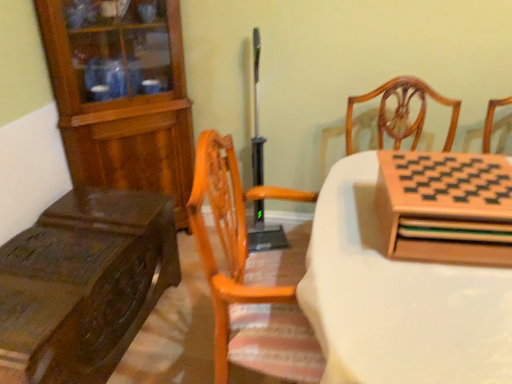
Describe the element at coordinates (397, 298) in the screenshot. I see `wooden chessboard at upper right, which appears as the 1th table when viewed from the right` at that location.

Where is `dark brown wood table at left, the first table positioned from the left`? dark brown wood table at left, the first table positioned from the left is located at coordinates (83, 284).

Locate an element on the screen. This screenshot has width=512, height=384. wooden cabinet at left, which ranks as the 2th cabinetry in front-to-back order is located at coordinates (123, 104).

The image size is (512, 384). Describe the element at coordinates (445, 207) in the screenshot. I see `wooden chessboard at right, the first cabinetry from the right` at that location.

What is the approximate height of wooden chessboard at right, the 1th cabinetry in the front-to-back sequence?

8.71 inches.

This screenshot has width=512, height=384. In order to click on wooden chessboard at upper right, which appears as the second table when viewed from the left in this screenshot , I will do `click(397, 298)`.

Considering the positions of objects wooden chessboard at right, the second cabinetry in the back-to-front sequence, and wooden chessboard at upper right, which appears as the 1th table when viewed from the right, in the image provided, who is more to the right, wooden chessboard at right, the second cabinetry in the back-to-front sequence, or wooden chessboard at upper right, which appears as the 1th table when viewed from the right,?

wooden chessboard at upper right, which appears as the 1th table when viewed from the right.

Does wooden chessboard at right, the 1th cabinetry in the front-to-back sequence, have a lesser height compared to wooden chessboard at upper right, which appears as the 1th table when viewed from the right?

Yes, wooden chessboard at right, the 1th cabinetry in the front-to-back sequence, is shorter than wooden chessboard at upper right, which appears as the 1th table when viewed from the right.

Considering the sizes of objects wooden chessboard at right, the first cabinetry from the right, and wooden chessboard at upper right, which appears as the second table when viewed from the left, in the image provided, who is wider, wooden chessboard at right, the first cabinetry from the right, or wooden chessboard at upper right, which appears as the second table when viewed from the left,?

With larger width is wooden chessboard at upper right, which appears as the second table when viewed from the left.

How different are the orientations of wooden chessboard at right, the second cabinetry when ordered from left to right, and wooden chessboard at upper right, which appears as the 1th table when viewed from the right, in degrees?

wooden chessboard at right, the second cabinetry when ordered from left to right, and wooden chessboard at upper right, which appears as the 1th table when viewed from the right, are facing 87.7 degrees away from each other.

From a real-world perspective, who is located lower, wooden cabinet at left, which ranks as the 2th cabinetry in front-to-back order, or wooden chessboard at upper right, which appears as the 1th table when viewed from the right?

In real-world perspective, wooden chessboard at upper right, which appears as the 1th table when viewed from the right, is lower.

From the image's perspective, is wooden cabinet at left, marked as the second cabinetry in a right-to-left arrangement, beneath wooden chessboard at upper right, which appears as the second table when viewed from the left?

Actually, wooden cabinet at left, marked as the second cabinetry in a right-to-left arrangement, appears above wooden chessboard at upper right, which appears as the second table when viewed from the left, in the image.

Which object is wider, wooden cabinet at left, marked as the second cabinetry in a right-to-left arrangement, or wooden chessboard at upper right, which appears as the second table when viewed from the left?

wooden chessboard at upper right, which appears as the second table when viewed from the left, is wider.

Which object is wider, wooden cabinet at left, which appears as the first cabinetry when viewed from the back, or dark brown wood table at left, the first table positioned from the left?

With larger width is dark brown wood table at left, the first table positioned from the left.

Considering the positions of point (175, 104) and point (38, 362), is point (175, 104) closer or farther from the camera than point (38, 362)?

Clearly, point (175, 104) is more distant from the camera than point (38, 362).

From a real-world perspective, is wooden cabinet at left, which appears as the first cabinetry when viewed from the back, above or below dark brown wood table at left, the second table when ordered from right to left?

In terms of real-world spatial position, wooden cabinet at left, which appears as the first cabinetry when viewed from the back, is above dark brown wood table at left, the second table when ordered from right to left.

From the image's perspective, which one is positioned lower, wooden cabinet at left, placed as the 1th cabinetry when sorted from left to right, or dark brown wood table at left, the first table positioned from the left?

From the image's view, dark brown wood table at left, the first table positioned from the left, is below.

Does wooden cabinet at left, which appears as the first cabinetry when viewed from the back, turn towards wooden chessboard at right, the second cabinetry when ordered from left to right?

Yes, wooden cabinet at left, which appears as the first cabinetry when viewed from the back, is aimed at wooden chessboard at right, the second cabinetry when ordered from left to right.

Between point (168, 113) and point (422, 174), which one is positioned behind?

Positioned behind is point (168, 113).

Who is more distant, wooden cabinet at left, which ranks as the 2th cabinetry in front-to-back order, or wooden chessboard at right, the 1th cabinetry in the front-to-back sequence?

wooden cabinet at left, which ranks as the 2th cabinetry in front-to-back order, is further away from the camera.

The height and width of the screenshot is (384, 512). In the image, there is a wooden chessboard at upper right, which appears as the 1th table when viewed from the right. Identify the location of table above it (from the image's perspective). (83, 284).

Measure the distance from dark brown wood table at left, the second table when ordered from right to left, to wooden chessboard at upper right, which appears as the second table when viewed from the left.

They are 34.56 inches apart.

From a real-world perspective, is dark brown wood table at left, the first table positioned from the left, positioned over wooden chessboard at upper right, which appears as the second table when viewed from the left, based on gravity?

No, from a real-world perspective, dark brown wood table at left, the first table positioned from the left, is not above wooden chessboard at upper right, which appears as the second table when viewed from the left.

Looking at this image, would you consider dark brown wood table at left, the second table when ordered from right to left, to be distant from wooden chessboard at upper right, which appears as the 1th table when viewed from the right?

Actually, dark brown wood table at left, the second table when ordered from right to left, and wooden chessboard at upper right, which appears as the 1th table when viewed from the right, are a little close together.

From the image's perspective, is wooden chessboard at upper right, which appears as the second table when viewed from the left, located above or below wooden chessboard at right, the second cabinetry in the back-to-front sequence?

Clearly, from the image's perspective, wooden chessboard at upper right, which appears as the second table when viewed from the left, is below wooden chessboard at right, the second cabinetry in the back-to-front sequence.

From a real-world perspective, starting from the wooden chessboard at upper right, which appears as the 1th table when viewed from the right, which cabinetry is the 2nd one vertically above it? Please provide its 2D coordinates.

[(445, 207)]

Is the depth of wooden chessboard at upper right, which appears as the 1th table when viewed from the right, greater than that of wooden chessboard at right, the first cabinetry from the right?

No, it is not.

Does dark brown wood table at left, the first table positioned from the left, lie behind wooden chessboard at right, the 1th cabinetry in the front-to-back sequence?

Yes, it is behind wooden chessboard at right, the 1th cabinetry in the front-to-back sequence.

Considering the points (12, 265) and (413, 198), which point is in front, point (12, 265) or point (413, 198)?

The point (413, 198) is closer.

From the image's perspective, relative to wooden chessboard at right, the second cabinetry when ordered from left to right, is dark brown wood table at left, the second table when ordered from right to left, above or below?

dark brown wood table at left, the second table when ordered from right to left, is situated lower than wooden chessboard at right, the second cabinetry when ordered from left to right, in the image.

From a real-world perspective, which is physically above, dark brown wood table at left, the first table positioned from the left, or wooden chessboard at right, the 1th cabinetry in the front-to-back sequence?

In real-world perspective, wooden chessboard at right, the 1th cabinetry in the front-to-back sequence, is above.

Locate an element on the screen. Image resolution: width=512 pixels, height=384 pixels. the 1st table directly beneath the wooden chessboard at right, the 1th cabinetry in the front-to-back sequence (from a real-world perspective) is located at coordinates [x=397, y=298].

From the image's perspective, count 2nd cabinetrys upward from the wooden chessboard at upper right, which appears as the 1th table when viewed from the right, and point to it. Please provide its 2D coordinates.

[(123, 104)]

Estimate the real-world distances between objects in this image. Which object is closer to wooden cabinet at left, which appears as the first cabinetry when viewed from the back, dark brown wood table at left, the first table positioned from the left, or wooden chessboard at upper right, which appears as the second table when viewed from the left?

dark brown wood table at left, the first table positioned from the left, is positioned closer to the anchor wooden cabinet at left, which appears as the first cabinetry when viewed from the back.

Looking at the image, which one is located closer to dark brown wood table at left, the first table positioned from the left, wooden chessboard at upper right, which appears as the second table when viewed from the left, or wooden cabinet at left, placed as the 1th cabinetry when sorted from left to right?

wooden cabinet at left, placed as the 1th cabinetry when sorted from left to right, is positioned closer to the anchor dark brown wood table at left, the first table positioned from the left.

Based on their spatial positions, is wooden chessboard at upper right, which appears as the second table when viewed from the left, or wooden chessboard at right, the second cabinetry in the back-to-front sequence, further from wooden cabinet at left, placed as the 1th cabinetry when sorted from left to right?

The object further to wooden cabinet at left, placed as the 1th cabinetry when sorted from left to right, is wooden chessboard at right, the second cabinetry in the back-to-front sequence.

Estimate the real-world distances between objects in this image. Which object is further from wooden chessboard at upper right, which appears as the 1th table when viewed from the right, wooden chessboard at right, the first cabinetry from the right, or dark brown wood table at left, the first table positioned from the left?

The object further to wooden chessboard at upper right, which appears as the 1th table when viewed from the right, is dark brown wood table at left, the first table positioned from the left.

When comparing their distances from wooden chessboard at right, the second cabinetry when ordered from left to right, does wooden chessboard at upper right, which appears as the 1th table when viewed from the right, or dark brown wood table at left, the first table positioned from the left, seem further?

dark brown wood table at left, the first table positioned from the left, is further to wooden chessboard at right, the second cabinetry when ordered from left to right.

Considering their positions, is wooden chessboard at right, the 1th cabinetry in the front-to-back sequence, positioned further to wooden cabinet at left, which appears as the first cabinetry when viewed from the back, than wooden chessboard at upper right, which appears as the 1th table when viewed from the right?

wooden chessboard at right, the 1th cabinetry in the front-to-back sequence, is positioned further to the anchor wooden cabinet at left, which appears as the first cabinetry when viewed from the back.

Based on their spatial positions, is wooden cabinet at left, marked as the second cabinetry in a right-to-left arrangement, or wooden chessboard at right, the first cabinetry from the right, closer to dark brown wood table at left, the second table when ordered from right to left?

wooden cabinet at left, marked as the second cabinetry in a right-to-left arrangement, is closer to dark brown wood table at left, the second table when ordered from right to left.

From the image, which object appears to be nearer to dark brown wood table at left, the second table when ordered from right to left, wooden chessboard at right, the 1th cabinetry in the front-to-back sequence, or wooden chessboard at upper right, which appears as the 1th table when viewed from the right?

wooden chessboard at upper right, which appears as the 1th table when viewed from the right.

In order to click on cabinetry between dark brown wood table at left, the second table when ordered from right to left, and wooden chessboard at right, the second cabinetry when ordered from left to right, from left to right in this screenshot , I will do `click(123, 104)`.

At what (x,y) coordinates should I click in order to perform the action: click on cabinetry between wooden cabinet at left, placed as the 1th cabinetry when sorted from left to right, and wooden chessboard at upper right, which appears as the 1th table when viewed from the right, in the horizontal direction. Please return your answer as a coordinate pair (x, y). This screenshot has height=384, width=512. Looking at the image, I should click on (445, 207).